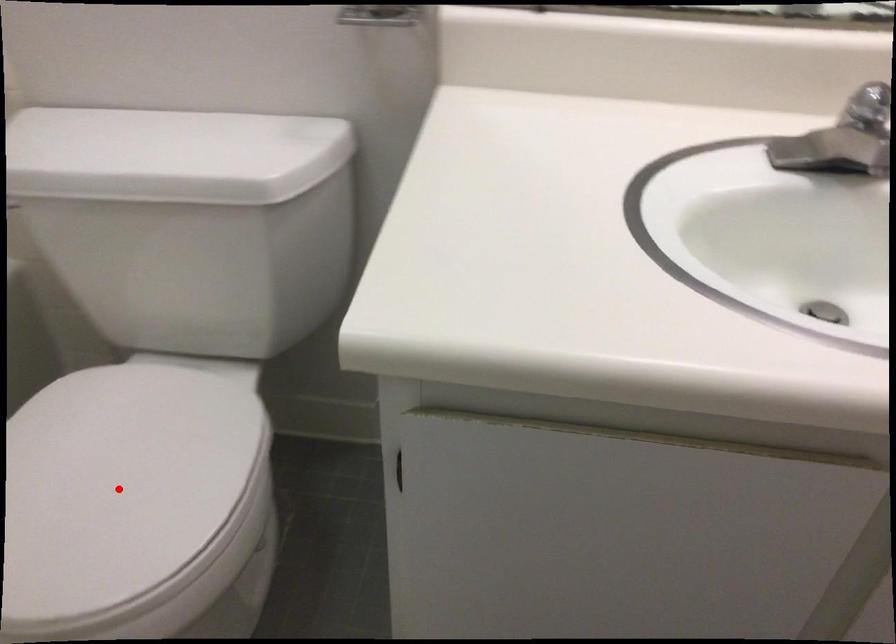
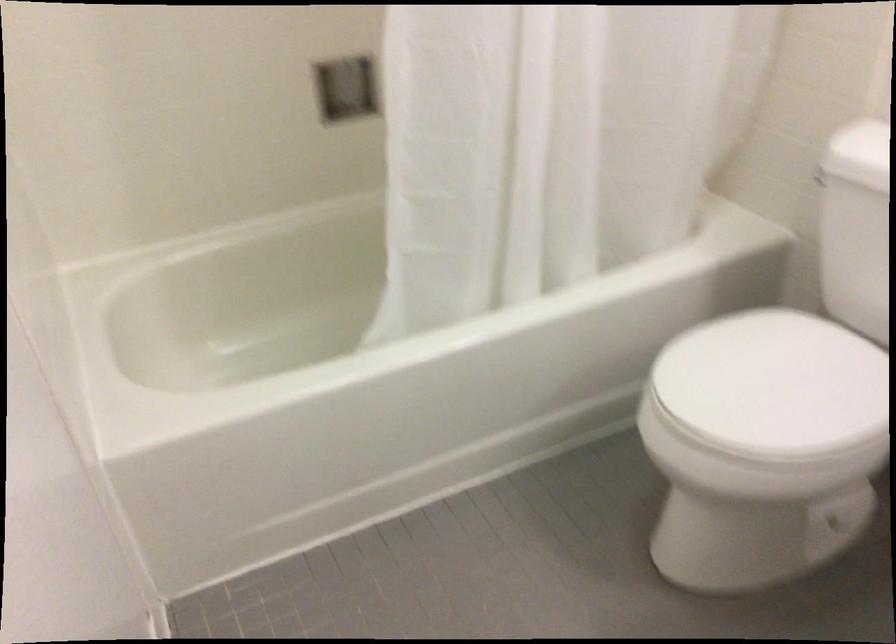
Find the pixel in the second image that matches the highlighted location in the first image.

(773, 384)